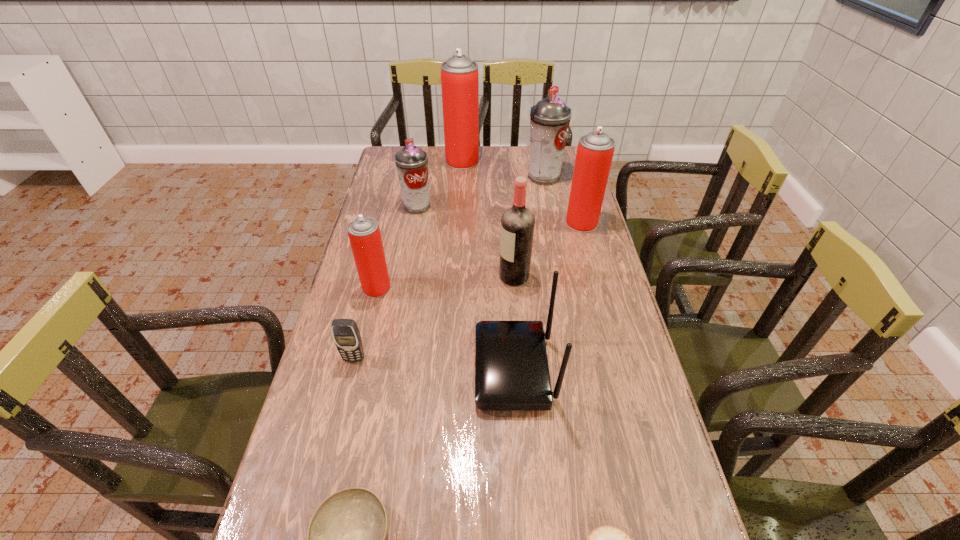
Locate an element on the screen. vacant space situated on the front of the smaller gray aerosol can is located at coordinates (412, 237).

At what (x,y) coordinates should I click in order to perform the action: click on vacant area situated on the front-facing side of the router. Please return your answer as a coordinate pair (x, y). The width and height of the screenshot is (960, 540). Looking at the image, I should click on (424, 369).

At what (x,y) coordinates should I click in order to perform the action: click on vacant area situated 0.160m on the front-facing side of the router. Please return your answer as a coordinate pair (x, y). Image resolution: width=960 pixels, height=540 pixels. Looking at the image, I should click on (413, 369).

Identify the location of free space located 0.150m on the front-facing side of the router. Image resolution: width=960 pixels, height=540 pixels. (417, 369).

Where is `free space located 0.170m on the front face of the cellular telephone`? This screenshot has height=540, width=960. free space located 0.170m on the front face of the cellular telephone is located at coordinates (338, 424).

This screenshot has width=960, height=540. What are the coordinates of `cellular telephone at the left edge` in the screenshot? It's located at coord(346,335).

Identify the location of object that is positioned at the far right corner. (549, 119).

Find the location of `vacant area at the far edge of the desktop`. vacant area at the far edge of the desktop is located at coordinates (502, 166).

You are a GUI agent. You are given a task and a screenshot of the screen. Output one action in this format:
    pyautogui.click(x=<x>, y=<y>)
    Task: Click on the vacant space at the left edge
    The image size is (960, 540).
    Given the screenshot: What is the action you would take?
    pyautogui.click(x=351, y=426)

In the image, there is a desktop. Where is `vacant space at the right edge`? The height and width of the screenshot is (540, 960). vacant space at the right edge is located at coordinates (571, 179).